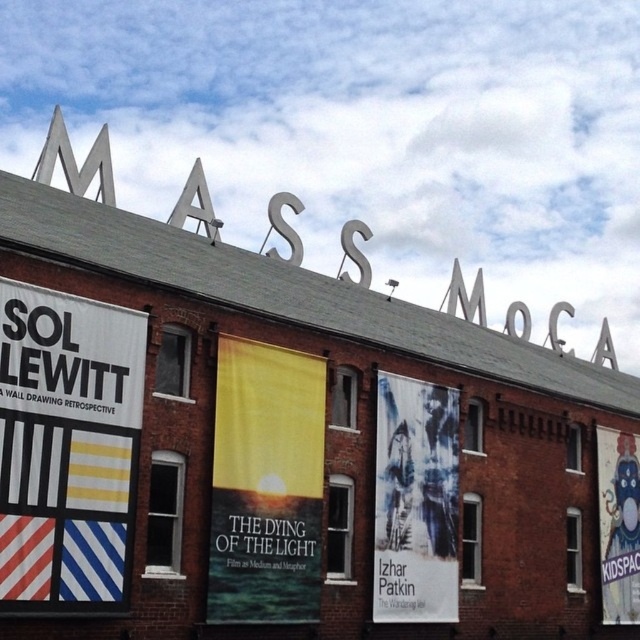
Question: Estimate the real-world distances between objects in this image. Which object is closer to the white paper banner at left?

Choices:
 (A) yellow matte banner at center
 (B) cartoonish fabric poster at right
 (C) blue fabric poster at center

Answer: (A)

Question: In this image, where is blue fabric poster at center located relative to cartoonish fabric poster at right?

Choices:
 (A) left
 (B) right

Answer: (A)

Question: Which point is farther from the camera taking this photo?

Choices:
 (A) (243, 346)
 (B) (444, 561)
 (C) (77, 428)

Answer: (B)

Question: From the image, what is the correct spatial relationship of yellow matte banner at center in relation to blue fabric poster at center?

Choices:
 (A) below
 (B) above

Answer: (B)

Question: Does blue fabric poster at center come behind cartoonish fabric poster at right?

Choices:
 (A) yes
 (B) no

Answer: (B)

Question: Which point appears farthest from the camera in this image?

Choices:
 (A) (444, 490)
 (B) (291, 388)
 (C) (48, 422)

Answer: (A)